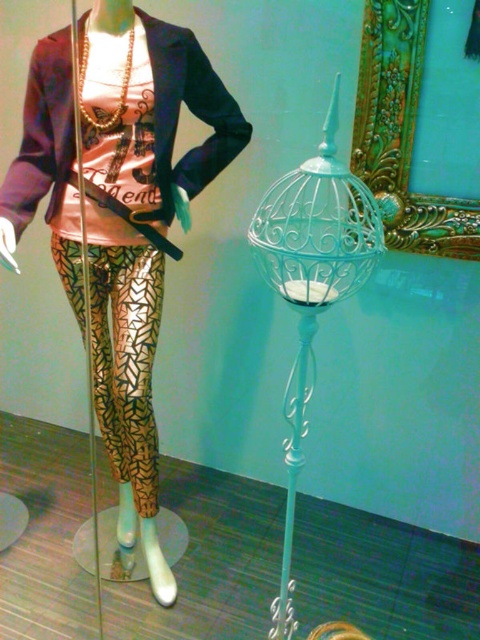
Is metallic gold pants at center shorter than white wrought iron lamp at right?

No, metallic gold pants at center is not shorter than white wrought iron lamp at right.

I want to click on metallic gold pants at center, so click(x=151, y=113).